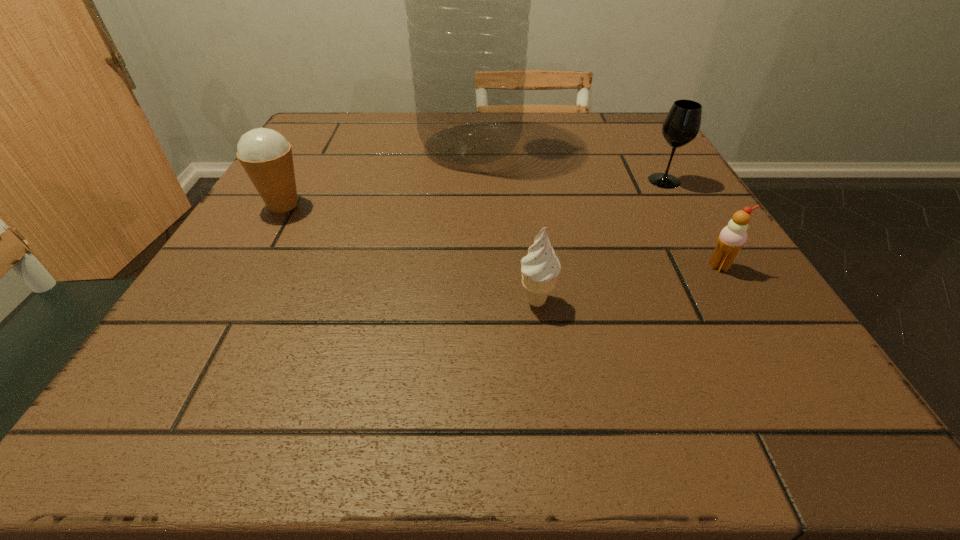
The width and height of the screenshot is (960, 540). Identify the location of unoccupied position between the farthest object and the nearest object. (503, 224).

Image resolution: width=960 pixels, height=540 pixels. Find the location of `unoccupied position between the second icecream from left to right and the farthest icecream`. unoccupied position between the second icecream from left to right and the farthest icecream is located at coordinates (410, 253).

This screenshot has width=960, height=540. I want to click on blank region between the second farthest icecream and the farthest object, so click(595, 206).

I want to click on unoccupied area between the nearest object and the shortest object, so click(x=628, y=284).

At what (x,y) coordinates should I click in order to perform the action: click on vacant area that lies between the rightmost icecream and the second farthest object. Please return your answer as a coordinate pair (x, y). The height and width of the screenshot is (540, 960). Looking at the image, I should click on (691, 224).

This screenshot has width=960, height=540. I want to click on object that is the nearest to the tallest object, so click(x=266, y=156).

Locate which object is the second closest to the nearest icecream. Please provide its 2D coordinates. Your answer should be formatted as a tuple, i.e. [(x, y)], where the tuple contains the x and y coordinates of a point satisfying the conditions above.

[(467, 0)]

Find the location of a particular element. The image size is (960, 540). the second closest icecream to the fourth nearest object is located at coordinates click(540, 268).

Image resolution: width=960 pixels, height=540 pixels. Identify the location of icecream that is the third closest to the tallest object. (732, 238).